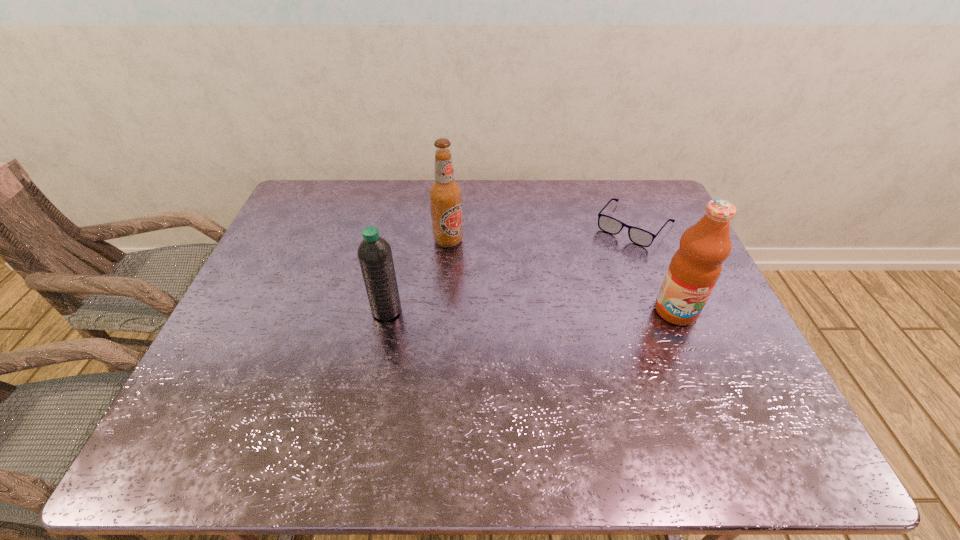
In order to click on free space between the second shortest object and the shortest object in this screenshot , I will do point(511,268).

Find the location of a particular element. The height and width of the screenshot is (540, 960). vacant area that lies between the leftmost object and the fruit juice is located at coordinates (531, 310).

You are a GUI agent. You are given a task and a screenshot of the screen. Output one action in this format:
    pyautogui.click(x=<x>, y=<y>)
    Task: Click on the empty location between the second shortest object and the second object from left to right
    The width and height of the screenshot is (960, 540).
    Given the screenshot: What is the action you would take?
    pyautogui.click(x=418, y=275)

Where is `free point between the spectacles and the fruit juice`? The image size is (960, 540). free point between the spectacles and the fruit juice is located at coordinates tap(656, 268).

Where is `object that is the closest one to the shortest object`? object that is the closest one to the shortest object is located at coordinates (694, 269).

Locate an element on the screen. Image resolution: width=960 pixels, height=540 pixels. object that ranks as the closest to the beer bottle is located at coordinates (374, 253).